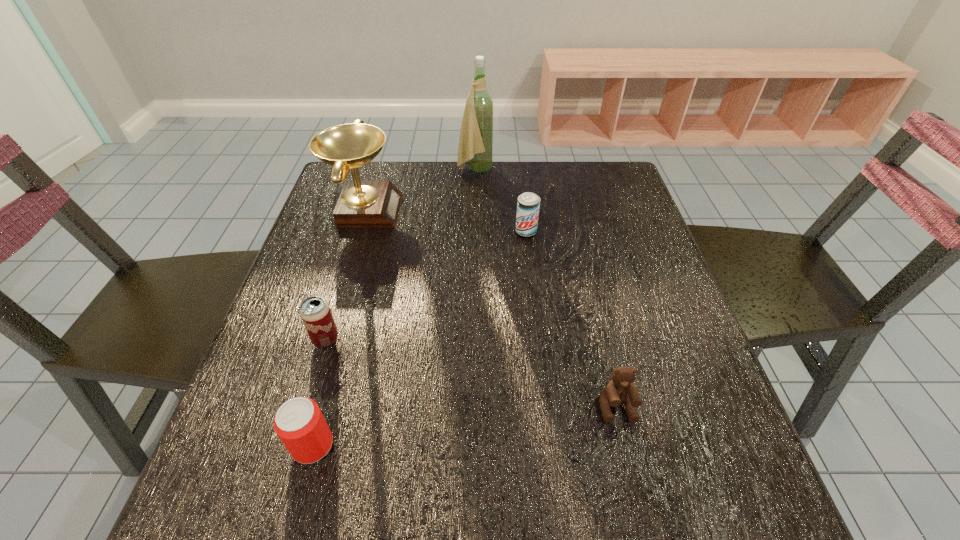
Identify the location of free space between the farthest beer can and the nearest object. This screenshot has width=960, height=540. (420, 338).

You are a GUI agent. You are given a task and a screenshot of the screen. Output one action in this format:
    pyautogui.click(x=<x>, y=<y>)
    Task: Click on the vacant space that is in between the rightmost object and the fifth shortest object
    The width and height of the screenshot is (960, 540).
    Given the screenshot: What is the action you would take?
    pyautogui.click(x=491, y=308)

Where is `vacant area that lies between the fifth object from left to right and the tallest object`? The image size is (960, 540). vacant area that lies between the fifth object from left to right and the tallest object is located at coordinates (500, 200).

Where is `vacant space that is in between the farthest object and the teddy bear`? This screenshot has height=540, width=960. vacant space that is in between the farthest object and the teddy bear is located at coordinates (545, 288).

The width and height of the screenshot is (960, 540). I want to click on free space between the second tallest object and the tallest object, so click(x=420, y=190).

I want to click on free area in between the farthest object and the nearest beer can, so click(394, 307).

Identify which object is the third nearest to the fourth object from left to right. Please provide its 2D coordinates. Your answer should be formatted as a tuple, i.e. [(x, y)], where the tuple contains the x and y coordinates of a point satisfying the conditions above.

[(315, 313)]

Find the location of a particular element. This screenshot has width=960, height=540. object that is the fourth closest to the fourth farthest object is located at coordinates 620,389.

Identify the location of beer can that is the second nearest to the second object from right to left. (299, 423).

I want to click on beer can that can be found as the third closest to the award, so click(x=299, y=423).